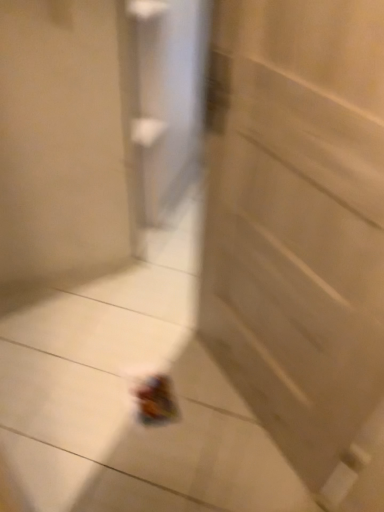
Question: Should I look upward or downward to see white matte door at center?

Choices:
 (A) down
 (B) up

Answer: (A)